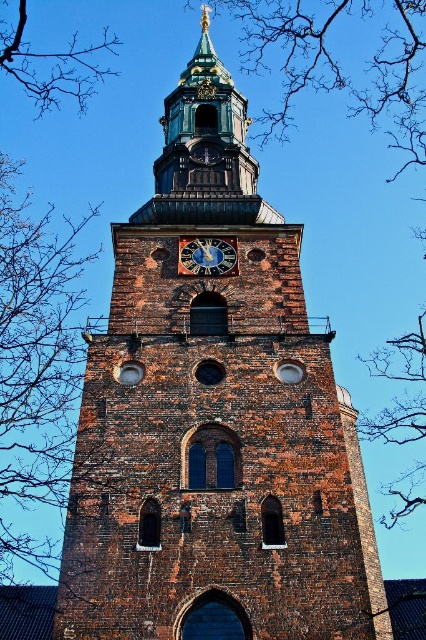
Who is positioned more to the left, bare branches at left or blue painted metal clock at center?

bare branches at left is more to the left.

Can you confirm if bare branches at left is positioned below blue painted metal clock at center?

Indeed, bare branches at left is positioned under blue painted metal clock at center.

Does point (46, 566) come behind point (233, 273)?

Yes, point (46, 566) is behind point (233, 273).

You are a GUI agent. You are given a task and a screenshot of the screen. Output one action in this format:
    pyautogui.click(x=<x>, y=<y>)
    Task: Click on the bare branches at left
    This screenshot has width=426, height=640.
    Given the screenshot: What is the action you would take?
    pyautogui.click(x=36, y=362)

Is bare branches at left shorter than bare branches at upper left?

Incorrect, bare branches at left's height does not fall short of bare branches at upper left's.

Where is `bare branches at left`? bare branches at left is located at coordinates (36, 362).

Describe the element at coordinates (36, 362) in the screenshot. I see `bare branches at left` at that location.

The width and height of the screenshot is (426, 640). I want to click on bare branches at left, so click(36, 362).

Can you confirm if bare branches at upper left is smaller than blue painted metal clock at center?

No.

Does bare branches at upper left have a lesser width compared to blue painted metal clock at center?

No.

What do you see at coordinates (51, 61) in the screenshot? This screenshot has height=640, width=426. I see `bare branches at upper left` at bounding box center [51, 61].

Locate an element on the screen. This screenshot has height=640, width=426. bare branches at upper left is located at coordinates (51, 61).